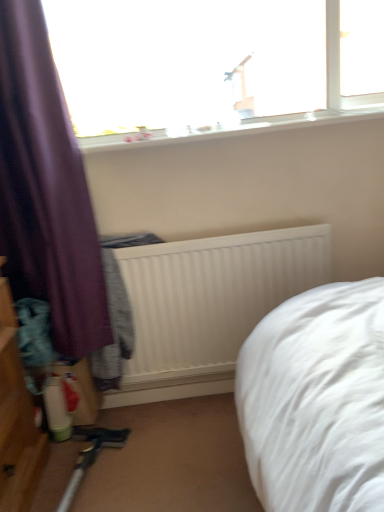
Question: Does white smooth window sill at upper center touch transparent glass window at upper center?

Choices:
 (A) no
 (B) yes

Answer: (A)

Question: Is transparent glass window at upper center a part of white smooth window sill at upper center?

Choices:
 (A) yes
 (B) no

Answer: (B)

Question: Is the position of white smooth window sill at upper center more distant than that of transparent glass window at upper center?

Choices:
 (A) no
 (B) yes

Answer: (B)

Question: Is white smooth window sill at upper center shorter than transparent glass window at upper center?

Choices:
 (A) yes
 (B) no

Answer: (A)

Question: Is white smooth window sill at upper center bigger than transparent glass window at upper center?

Choices:
 (A) yes
 (B) no

Answer: (B)

Question: Is transparent glass window at upper center taller or shorter than white smooth window sill at upper center?

Choices:
 (A) short
 (B) tall

Answer: (B)

Question: Is transparent glass window at upper center spatially inside white smooth window sill at upper center, or outside of it?

Choices:
 (A) inside
 (B) outside

Answer: (B)

Question: From the image's perspective, is transparent glass window at upper center positioned above or below white smooth window sill at upper center?

Choices:
 (A) above
 (B) below

Answer: (A)

Question: Would you say transparent glass window at upper center is to the left or to the right of white smooth window sill at upper center in the picture?

Choices:
 (A) right
 (B) left

Answer: (B)

Question: From a real-world perspective, is white smooth window sill at upper center above or below white ribbed radiator at center?

Choices:
 (A) below
 (B) above

Answer: (B)

Question: In terms of height, does white smooth window sill at upper center look taller or shorter compared to white ribbed radiator at center?

Choices:
 (A) short
 (B) tall

Answer: (A)

Question: Looking at the image, does white smooth window sill at upper center seem bigger or smaller compared to white ribbed radiator at center?

Choices:
 (A) small
 (B) big

Answer: (A)

Question: From the image's perspective, is white smooth window sill at upper center located above or below white ribbed radiator at center?

Choices:
 (A) above
 (B) below

Answer: (A)

Question: Would you say white ribbed radiator at center is inside or outside white smooth window sill at upper center?

Choices:
 (A) outside
 (B) inside

Answer: (A)

Question: From their relative heights in the image, would you say white ribbed radiator at center is taller or shorter than white smooth window sill at upper center?

Choices:
 (A) short
 (B) tall

Answer: (B)